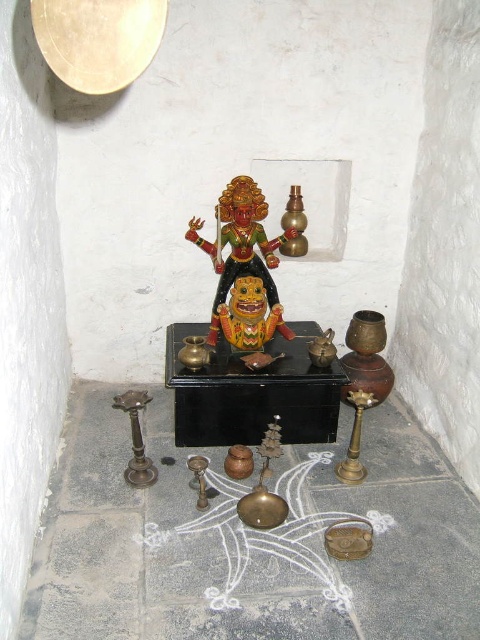
Which is behind, point (176, 428) or point (231, 195)?

The point (176, 428) is more distant.

Which is more to the left, black polished altar at center or glossy painted deity at center?

From the viewer's perspective, glossy painted deity at center appears more on the left side.

Does point (301, 410) lie in front of point (245, 234)?

Yes, point (301, 410) is closer to viewer.

This screenshot has width=480, height=640. Find the location of `black polished altar at center`. black polished altar at center is located at coordinates (252, 392).